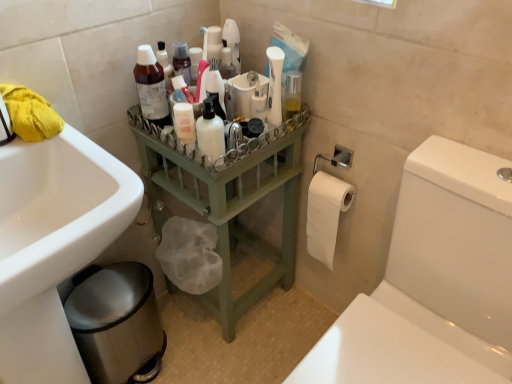
This screenshot has height=384, width=512. Find the location of `free location above metallic silver bidet at lower left (from a real-world perspective)`. free location above metallic silver bidet at lower left (from a real-world perspective) is located at coordinates (108, 293).